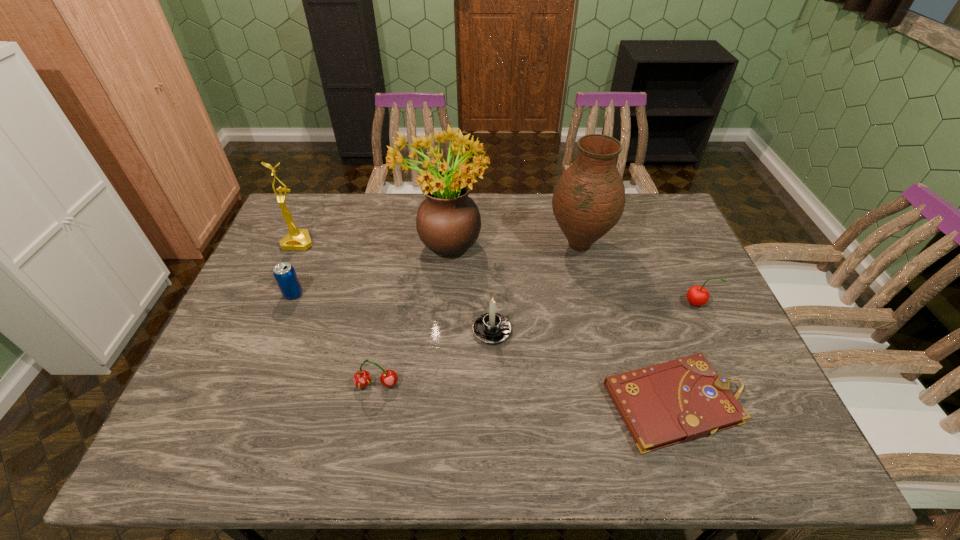
In order to click on free region located on the front of the vase in this screenshot , I will do `click(604, 347)`.

I want to click on vacant space situated 0.380m on the front-facing side of the sixth shortest object, so click(x=251, y=350).

The height and width of the screenshot is (540, 960). What are the coordinates of `free region located 0.080m with a handle on the side of the third nearest object` in the screenshot? It's located at (541, 330).

I want to click on free point located 0.330m on the front of the right cherry, so click(751, 422).

Identify the location of free location located on the back of the pop soda. The height and width of the screenshot is (540, 960). [x=324, y=220].

Where is `free spot located 0.100m with stems pointing upwards on the nearer cherry`? This screenshot has height=540, width=960. free spot located 0.100m with stems pointing upwards on the nearer cherry is located at coordinates (368, 433).

The image size is (960, 540). Identify the location of vacant position located 0.220m on the left of the shortest object. (513, 403).

Locate an element on the screen. The image size is (960, 540). flower arrangement that is at the far edge is located at coordinates (448, 222).

Find the location of a particular element. This screenshot has height=540, width=960. vase located at the far edge is located at coordinates (588, 200).

This screenshot has height=540, width=960. In order to click on award present at the far edge in this screenshot , I will do `click(297, 239)`.